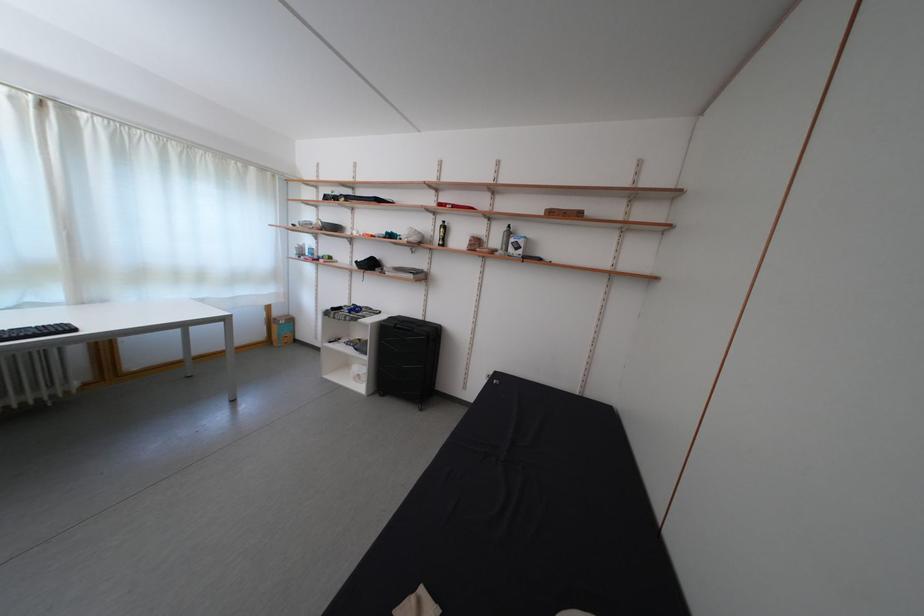
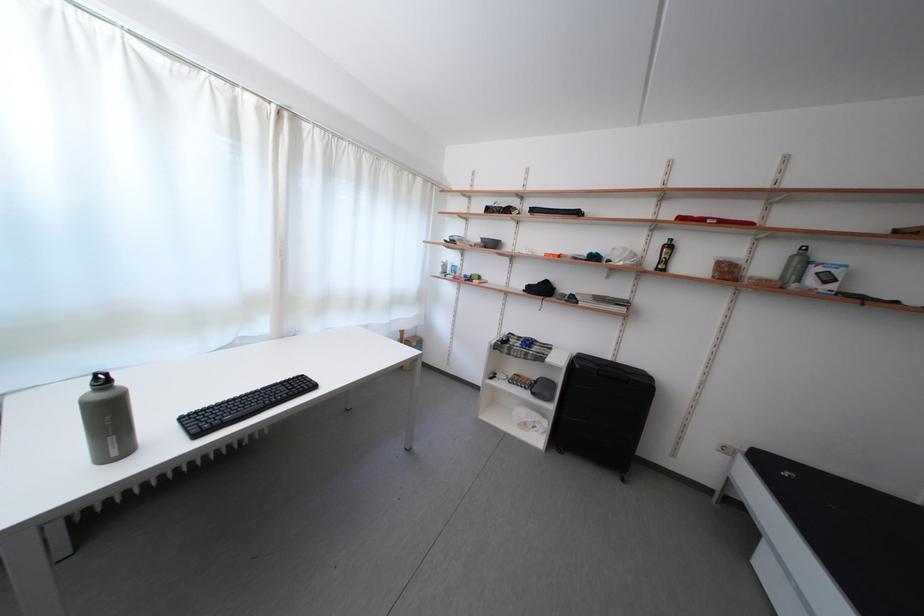
Where in the second image is the point corresponding to point (485, 252) from the first image?

(736, 278)